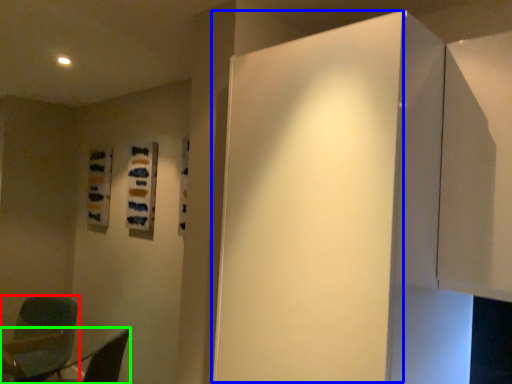
Question: Considering the real-world distances, which object is closest to chair (highlighted by a red box)? door (highlighted by a blue box) or furniture (highlighted by a green box).

Choices:
 (A) door
 (B) furniture

Answer: (B)